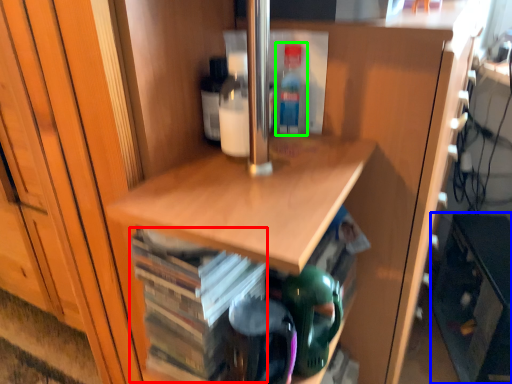
Question: Which object is the farthest from book (highlighted by a red box)? Choose among these: cabinetry (highlighted by a blue box) or bottle (highlighted by a green box).

Choices:
 (A) cabinetry
 (B) bottle

Answer: (A)